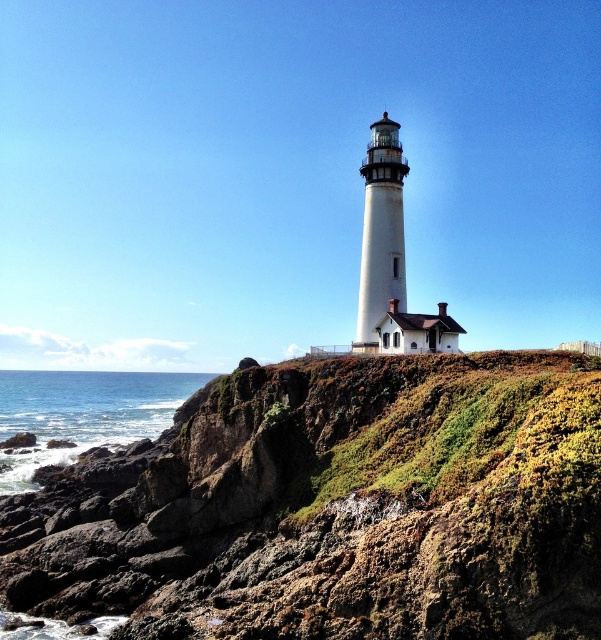
You are a geologist examining the coastal cliff and notice the green mossy rock at center. Can you determine its exact position relative to the lighthouse?

The green mossy rock at center is located at point coordinates of (334, 506) relative to the lighthouse, so it is positioned to the right and slightly below the lighthouse.

You are planning to place a small garden statue that is 1 meter wide between the green mossy rock at center and the blue water at lower left. Based on the scene description, will the statue fit between them?

The green mossy rock at center is narrower than the blue water at lower left. However, the exact distance between them isn not specified in the objects description. The statue requires 1 meter of space, but without knowing the actual gap between the two objects, it is impossible to determine if the statue will fit.

You are a hiker who has just arrived at the cliff edge. You see the green mossy rock at center and the blue water at lower left. Which object is bigger in size?

The green mossy rock at center has a larger size compared to the blue water at lower left, so the green mossy rock at center is bigger.